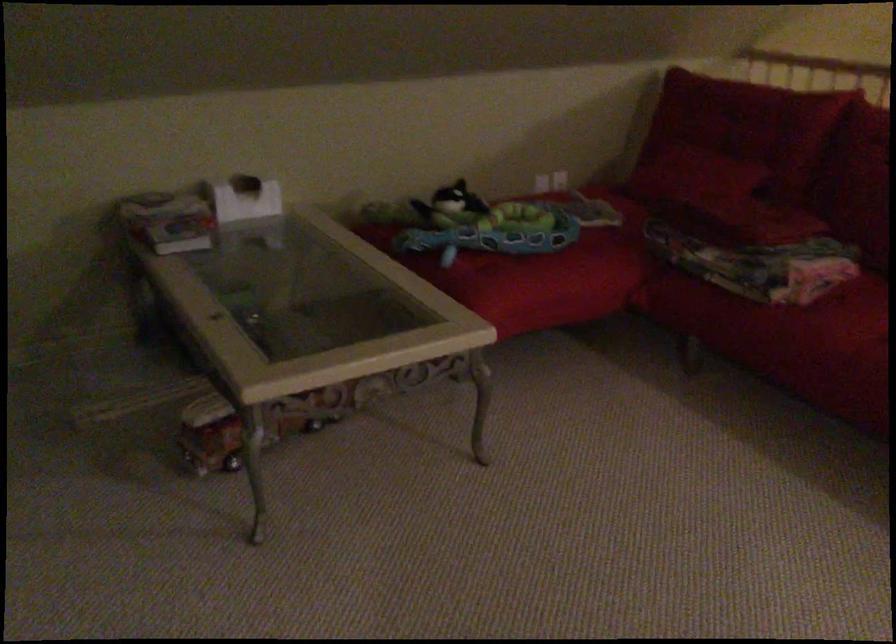
Locate an element on the screen. Image resolution: width=896 pixels, height=644 pixels. white tissue box is located at coordinates (245, 201).